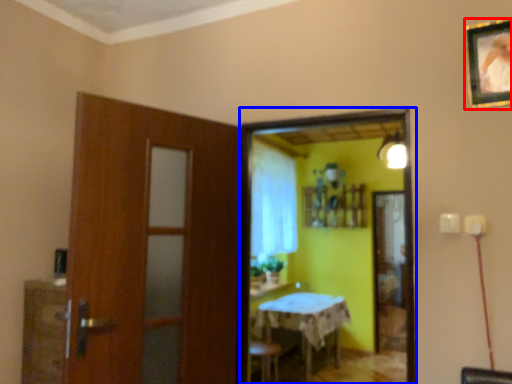
Question: Which object appears farthest to the camera in this image, picture frame (highlighted by a red box) or mirror (highlighted by a blue box)?

Choices:
 (A) picture frame
 (B) mirror

Answer: (B)